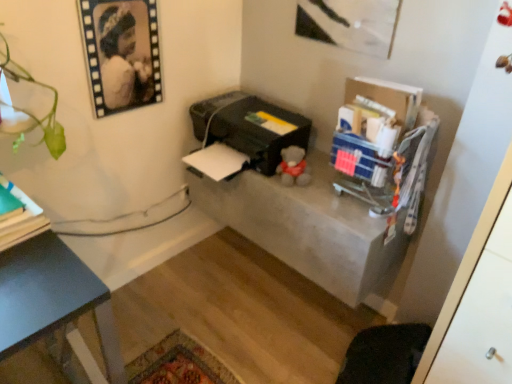
Question: From the image's perspective, is black matte portrait at upper left on top of black plastic printer at center?

Choices:
 (A) yes
 (B) no

Answer: (A)

Question: Is black matte portrait at upper left shorter than black plastic printer at center?

Choices:
 (A) yes
 (B) no

Answer: (B)

Question: Is black matte portrait at upper left behind black plastic printer at center?

Choices:
 (A) no
 (B) yes

Answer: (A)

Question: Is black matte portrait at upper left outside black plastic printer at center?

Choices:
 (A) no
 (B) yes

Answer: (B)

Question: Is black matte portrait at upper left wider than black plastic printer at center?

Choices:
 (A) yes
 (B) no

Answer: (B)

Question: Can you confirm if black matte portrait at upper left is smaller than black plastic printer at center?

Choices:
 (A) no
 (B) yes

Answer: (B)

Question: Is black matte portrait at upper left at the right side of concrete table at center?

Choices:
 (A) no
 (B) yes

Answer: (A)

Question: Is black matte portrait at upper left surrounding concrete table at center?

Choices:
 (A) yes
 (B) no

Answer: (B)

Question: Does black matte portrait at upper left turn towards concrete table at center?

Choices:
 (A) yes
 (B) no

Answer: (B)

Question: Is black matte portrait at upper left to the left of concrete table at center from the viewer's perspective?

Choices:
 (A) yes
 (B) no

Answer: (A)

Question: Does black matte portrait at upper left have a larger size compared to concrete table at center?

Choices:
 (A) no
 (B) yes

Answer: (A)

Question: Are black matte portrait at upper left and concrete table at center beside each other?

Choices:
 (A) yes
 (B) no

Answer: (B)

Question: Is black plastic printer at center taller than concrete table at center?

Choices:
 (A) no
 (B) yes

Answer: (A)